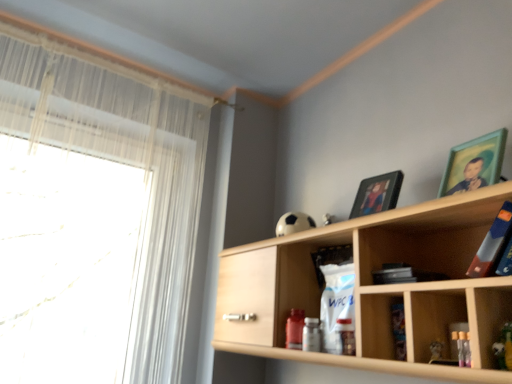
Where is `green matte picture frame at upper right, arranged as the second picture frame when viewed from the back`? The height and width of the screenshot is (384, 512). green matte picture frame at upper right, arranged as the second picture frame when viewed from the back is located at coordinates (474, 164).

This screenshot has width=512, height=384. What are the coordinates of `hardcover book at upper right` in the screenshot? It's located at (492, 243).

There is a wooden shelf at upper right. At what (x,y) coordinates should I click in order to perform the action: click on the 1st picture frame above it (from the image's perspective). Please return your answer as a coordinate pair (x, y). The height and width of the screenshot is (384, 512). Looking at the image, I should click on (377, 194).

Does wooden shelf at upper right have a greater height compared to matte black picture frame at upper center, the 1th picture frame from the left?

Yes.

Consider the image. From a real-world perspective, between wooden shelf at upper right and matte black picture frame at upper center, the 1th picture frame from the left, who is vertically higher?

matte black picture frame at upper center, the 1th picture frame from the left.

From the picture: Is wooden shelf at upper right positioned before matte black picture frame at upper center, which is the second picture frame in front-to-back order?

Yes, it is.

Between green matte picture frame at upper right, marked as the 2th picture frame in a left-to-right arrangement, and wooden shelf at upper right, which one has larger width?

wooden shelf at upper right.

Which of these two, green matte picture frame at upper right, arranged as the first picture frame when viewed from the right, or wooden shelf at upper right, stands taller?

wooden shelf at upper right is taller.

The height and width of the screenshot is (384, 512). In order to click on shelf located on the left of green matte picture frame at upper right, arranged as the second picture frame when viewed from the back in this screenshot , I will do `click(376, 287)`.

In the image, is green matte picture frame at upper right, arranged as the first picture frame when viewed from the right, on the left side or the right side of wooden shelf at upper right?

green matte picture frame at upper right, arranged as the first picture frame when viewed from the right, is to the right of wooden shelf at upper right.

Are hardcover book at upper right and matte black picture frame at upper center, which is the second picture frame in front-to-back order, making contact?

No, hardcover book at upper right is not beside matte black picture frame at upper center, which is the second picture frame in front-to-back order.

Considering the relative positions of hardcover book at upper right and matte black picture frame at upper center, the first picture frame from the back, in the image provided, is hardcover book at upper right behind matte black picture frame at upper center, the first picture frame from the back,?

No, it is not.

Is point (498, 251) closer to camera compared to point (358, 189)?

Yes, it is in front of point (358, 189).

Based on the photo, is white sheer curtain at left situated inside green matte picture frame at upper right, arranged as the second picture frame when viewed from the back, or outside?

white sheer curtain at left cannot be found inside green matte picture frame at upper right, arranged as the second picture frame when viewed from the back.

Measure the distance between white sheer curtain at left and green matte picture frame at upper right, the 1th picture frame from the front.

white sheer curtain at left is 3.58 feet from green matte picture frame at upper right, the 1th picture frame from the front.

Is white sheer curtain at left aimed at green matte picture frame at upper right, arranged as the first picture frame when viewed from the right?

Yes, white sheer curtain at left is oriented towards green matte picture frame at upper right, arranged as the first picture frame when viewed from the right.

Which is more to the right, white sheer curtain at left or green matte picture frame at upper right, arranged as the first picture frame when viewed from the right?

Positioned to the right is green matte picture frame at upper right, arranged as the first picture frame when viewed from the right.

Which object is more forward, matte black picture frame at upper center, which is the second picture frame in front-to-back order, or wooden shelf at upper right?

wooden shelf at upper right.

From the picture: Is matte black picture frame at upper center, the 1th picture frame from the left, positioned beyond the bounds of wooden shelf at upper right?

matte black picture frame at upper center, the 1th picture frame from the left, is positioned outside wooden shelf at upper right.

Based on the photo, is matte black picture frame at upper center, which is the second picture frame in front-to-back order, oriented towards wooden shelf at upper right?

No.

Is matte black picture frame at upper center, the first picture frame from the back, to the left of wooden shelf at upper right from the viewer's perspective?

In fact, matte black picture frame at upper center, the first picture frame from the back, is to the right of wooden shelf at upper right.

Which object is wider, hardcover book at upper right or white sheer curtain at left?

Wider between the two is white sheer curtain at left.

Is hardcover book at upper right facing towards white sheer curtain at left?

No.

Is hardcover book at upper right next to white sheer curtain at left and touching it?

hardcover book at upper right and white sheer curtain at left are clearly separated.

Can you confirm if hardcover book at upper right is taller than white sheer curtain at left?

Incorrect, the height of hardcover book at upper right is not larger of that of white sheer curtain at left.

From a real-world perspective, between matte black picture frame at upper center, which is the second picture frame in front-to-back order, and green matte picture frame at upper right, the 1th picture frame from the front, who is vertically higher?

In real-world perspective, green matte picture frame at upper right, the 1th picture frame from the front, is above.

From the image's perspective, is matte black picture frame at upper center, which is the second picture frame in front-to-back order, beneath green matte picture frame at upper right, arranged as the second picture frame when viewed from the back?

Correct, matte black picture frame at upper center, which is the second picture frame in front-to-back order, appears lower than green matte picture frame at upper right, arranged as the second picture frame when viewed from the back, in the image.

Is matte black picture frame at upper center, which is the second picture frame in front-to-back order, positioned far away from green matte picture frame at upper right, arranged as the first picture frame when viewed from the right?

No.

Locate an element on the screen. picture frame in front of the matte black picture frame at upper center, which is the second picture frame in front-to-back order is located at coordinates (474, 164).

At what (x,y) coordinates should I click in order to perform the action: click on the 1st picture frame to the right of the wooden shelf at upper right, starting your count from the anchor. Please return your answer as a coordinate pair (x, y). Looking at the image, I should click on (377, 194).

You are a GUI agent. You are given a task and a screenshot of the screen. Output one action in this format:
    pyautogui.click(x=<x>, y=<y>)
    Task: Click on the picture frame that is the 1st object located behind the wooden shelf at upper right
    The image size is (512, 384).
    Given the screenshot: What is the action you would take?
    pyautogui.click(x=474, y=164)

Considering their positions, is wooden shelf at upper right positioned further to hardcover book at upper right than green matte picture frame at upper right, marked as the 2th picture frame in a left-to-right arrangement?

wooden shelf at upper right is further to hardcover book at upper right.

Which object lies nearer to the anchor point green matte picture frame at upper right, the 1th picture frame from the front, wooden shelf at upper right or hardcover book at upper right?

hardcover book at upper right is closer to green matte picture frame at upper right, the 1th picture frame from the front.

Based on their spatial positions, is white sheer curtain at left or wooden shelf at upper right further from green matte picture frame at upper right, the 1th picture frame from the front?

white sheer curtain at left is further to green matte picture frame at upper right, the 1th picture frame from the front.

From the picture: When comparing their distances from matte black picture frame at upper center, which is the second picture frame in front-to-back order, does wooden shelf at upper right or green matte picture frame at upper right, arranged as the second picture frame when viewed from the back, seem further?

wooden shelf at upper right lies further to matte black picture frame at upper center, which is the second picture frame in front-to-back order, than the other object.

From the image, which object appears to be farther from green matte picture frame at upper right, arranged as the first picture frame when viewed from the right, hardcover book at upper right or wooden shelf at upper right?

The object further to green matte picture frame at upper right, arranged as the first picture frame when viewed from the right, is wooden shelf at upper right.

When comparing their distances from matte black picture frame at upper center, the second picture frame positioned from the right, does wooden shelf at upper right or hardcover book at upper right seem closer?

wooden shelf at upper right lies closer to matte black picture frame at upper center, the second picture frame positioned from the right, than the other object.

Based on the photo, looking at the image, which one is located closer to green matte picture frame at upper right, arranged as the second picture frame when viewed from the back, matte black picture frame at upper center, the first picture frame from the back, or wooden shelf at upper right?

The object closer to green matte picture frame at upper right, arranged as the second picture frame when viewed from the back, is matte black picture frame at upper center, the first picture frame from the back.

Which object lies further to the anchor point hardcover book at upper right, white sheer curtain at left or matte black picture frame at upper center, the 1th picture frame from the left?

The object further to hardcover book at upper right is white sheer curtain at left.

Find the location of a particular element. book between green matte picture frame at upper right, arranged as the first picture frame when viewed from the right, and wooden shelf at upper right, in the vertical direction is located at coordinates (492, 243).

Where is `shelf located between white sheer curtain at left and matte black picture frame at upper center, the second picture frame positioned from the right, in the left-right direction`? shelf located between white sheer curtain at left and matte black picture frame at upper center, the second picture frame positioned from the right, in the left-right direction is located at coordinates (376, 287).

Where is `book between wooden shelf at upper right and matte black picture frame at upper center, which is the second picture frame in front-to-back order, along the z-axis`? book between wooden shelf at upper right and matte black picture frame at upper center, which is the second picture frame in front-to-back order, along the z-axis is located at coordinates (492, 243).

Locate an element on the screen. Image resolution: width=512 pixels, height=384 pixels. picture frame located between wooden shelf at upper right and matte black picture frame at upper center, the first picture frame from the back, in the depth direction is located at coordinates (474, 164).